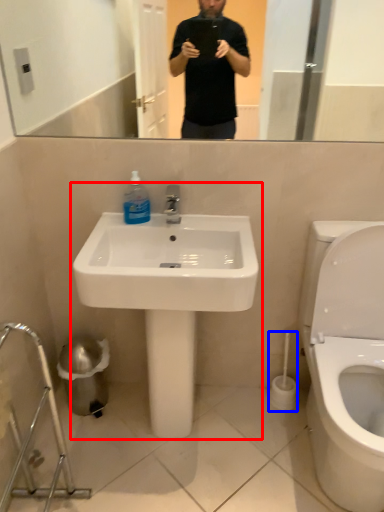
Question: Among these objects, which one is farthest to the camera, sink (highlighted by a red box) or brush (highlighted by a blue box)?

Choices:
 (A) sink
 (B) brush

Answer: (B)